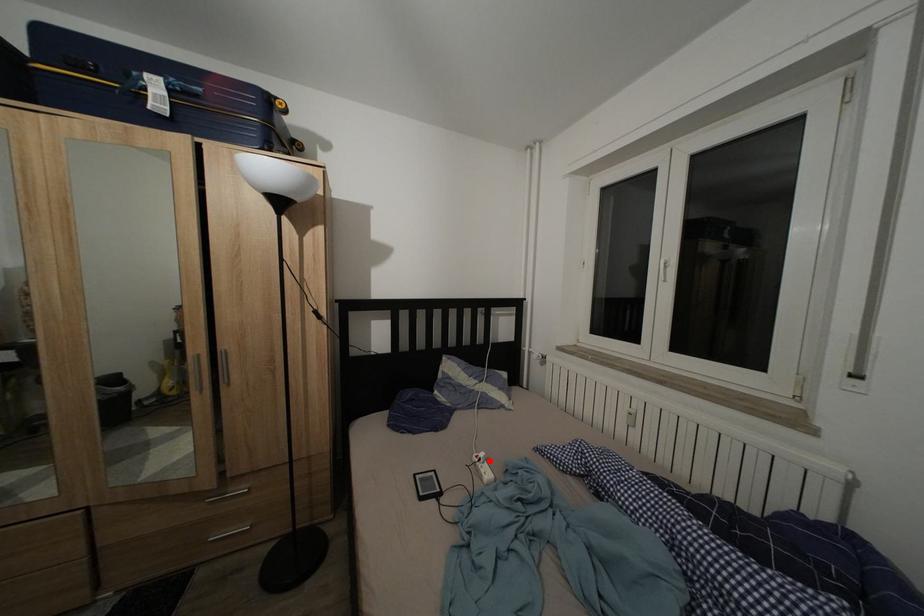
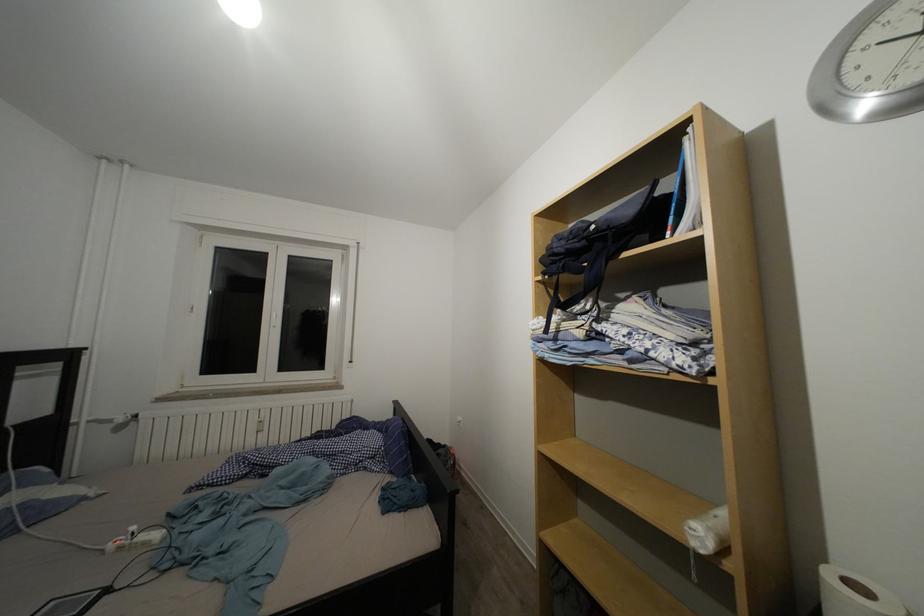
Question: I am providing you with two images of the same scene from different viewpoints. A red point is marked on the first image. Is the red point's position out of view in image 2?

Choices:
 (A) Yes
 (B) No

Answer: (B)